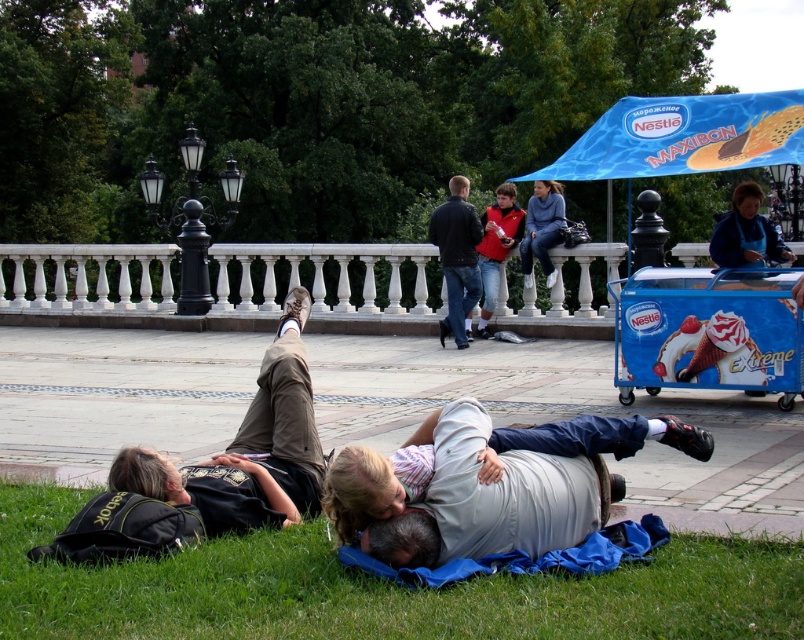
Which is behind, point (450, 241) or point (745, 180)?

The point (745, 180) is more distant.

You are a GUI agent. You are given a task and a screenshot of the screen. Output one action in this format:
    pyautogui.click(x=<x>, y=<y>)
    Task: Click on the dark blue jeans at center
    The image size is (804, 640).
    Given the screenshot: What is the action you would take?
    (x=457, y=257)

Which is below, green grass at lower center or light brown hair at lower center?

Positioned lower is green grass at lower center.

Can you confirm if green grass at lower center is smaller than light brown hair at lower center?

Correct, green grass at lower center occupies less space than light brown hair at lower center.

Is point (355, 634) farther from camera compared to point (610, 432)?

No, (355, 634) is closer to viewer.

Locate an element on the screen. This screenshot has width=804, height=640. green grass at lower center is located at coordinates (379, 589).

Between light brown hair at lower center and blue plastic cart at lower right, which one appears on the right side from the viewer's perspective?

Positioned to the right is blue plastic cart at lower right.

Does point (505, 436) lie behind point (645, 355)?

No.

This screenshot has width=804, height=640. What are the coordinates of `light brown hair at lower center` in the screenshot? It's located at (490, 484).